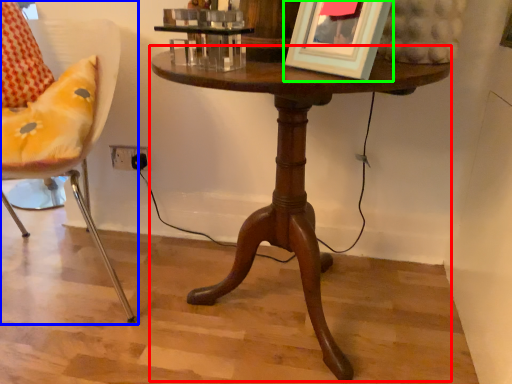
Question: Which object is positioned farthest from table (highlighted by a red box)? Select from chair (highlighted by a blue box) and picture frame (highlighted by a green box).

Choices:
 (A) chair
 (B) picture frame

Answer: (A)